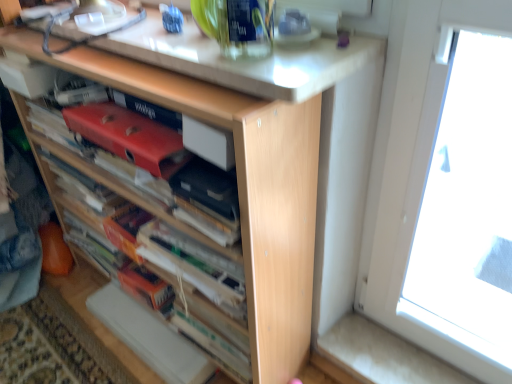
At what (x,y) coordinates should I click in order to perform the action: click on vacant area on top of matte red paperback book at center, positioned as the 1th paperback book in left-to-right order (from a real-world perspective). Please return your answer as a coordinate pair (x, y). Image resolution: width=512 pixels, height=384 pixels. Looking at the image, I should click on (122, 112).